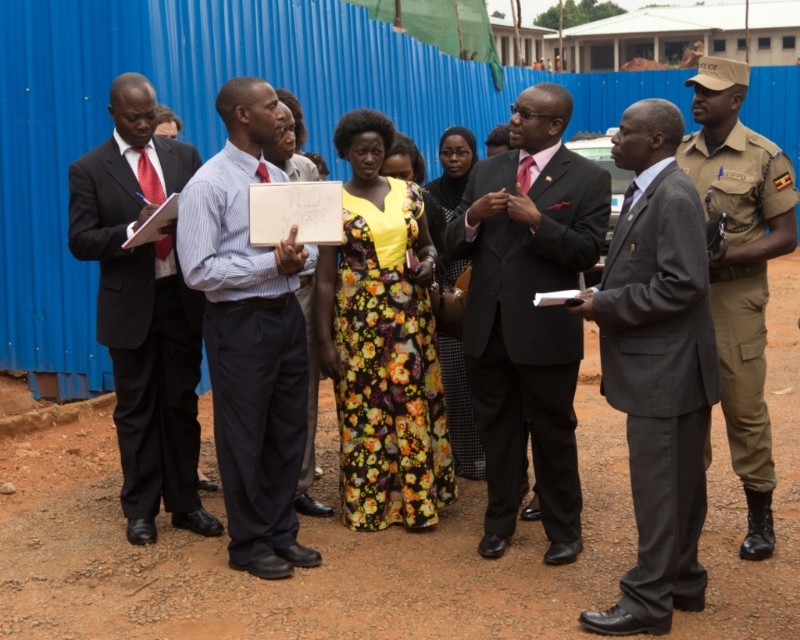
You are a photographer trying to capture a group photo of the khaki uniform at right and the light blue shirt at center. Since you want both subjects to appear equally sized in the photo, which subject should you move closer to the camera?

The khaki uniform at right is much taller than the light blue shirt at center, so to make them appear equally sized in the photo, you should move the khaki uniform at right closer to the camera.

From the picture: You are attending a site meeting at the construction site. You need to identify the person in the black suit at left and the floral fabric dress at center. Which one is bigger in size?

The black suit at left has a larger size compared to the floral fabric dress at center.